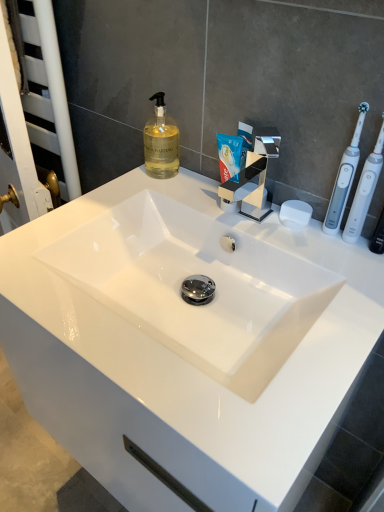
Image resolution: width=384 pixels, height=512 pixels. Identify the location of free space that is in between white plastic toothbrush at right, positioned as the second toothbrush in left-to-right order, and chrome metallic tap at center. (289, 238).